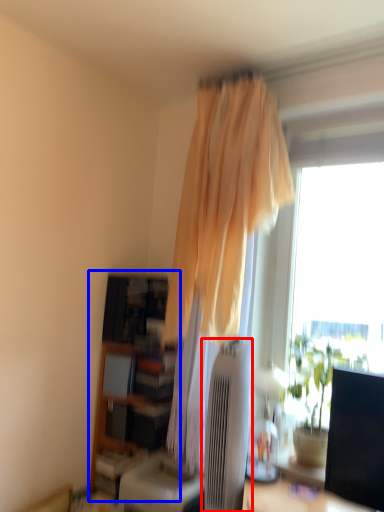
Question: Which object appears farthest to the camera in this image, air conditioner (highlighted by a red box) or bookshelf (highlighted by a blue box)?

Choices:
 (A) air conditioner
 (B) bookshelf

Answer: (B)